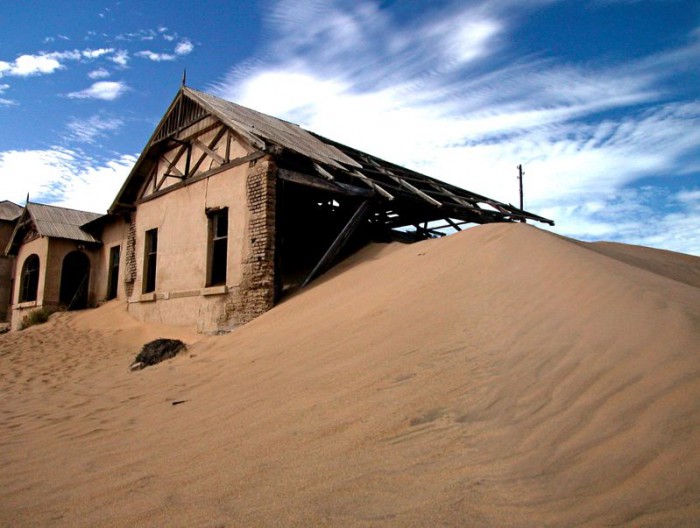
Locate an element on the screen. The width and height of the screenshot is (700, 528). doorways is located at coordinates (74, 266).